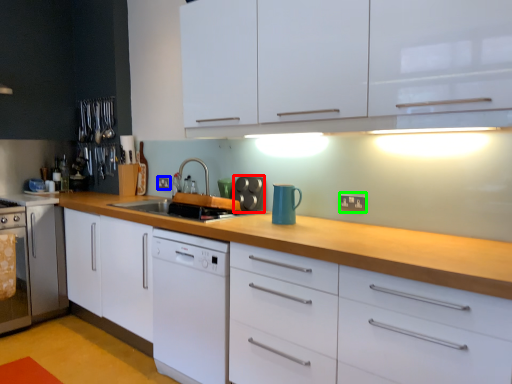
Question: Which is nearer to the appliance (highlighted by a red box)? electric outlet (highlighted by a blue box) or electric outlet (highlighted by a green box).

Choices:
 (A) electric outlet
 (B) electric outlet

Answer: (B)